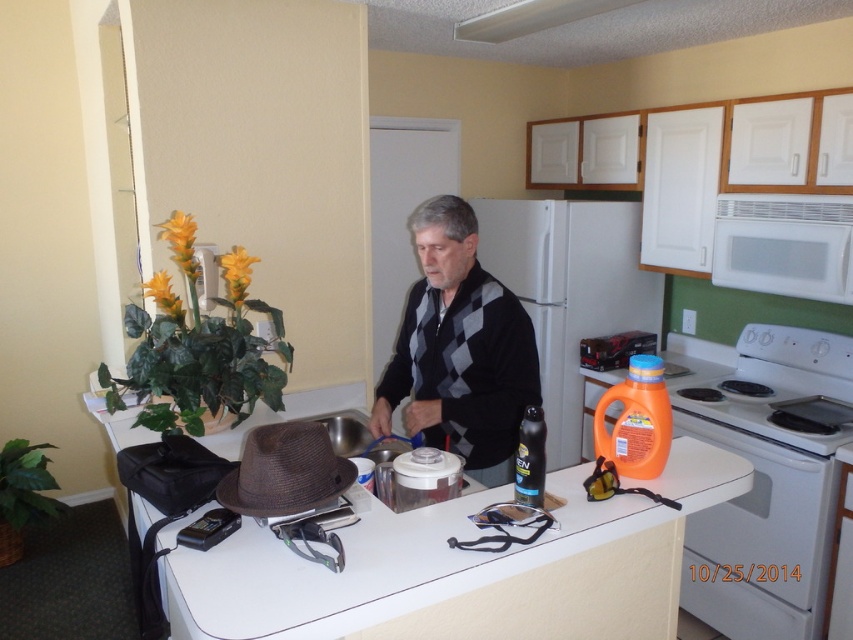
Question: Does orange plastic detergent at right appear on the left side of matte black spray can at center?

Choices:
 (A) no
 (B) yes

Answer: (A)

Question: Is white matte counter at center thinner than orange plastic detergent at right?

Choices:
 (A) yes
 (B) no

Answer: (B)

Question: Is gray argyle sweater at center further to the viewer compared to white glossy stove at right?

Choices:
 (A) no
 (B) yes

Answer: (A)

Question: Which of these objects is positioned farthest from the matte black spray can at center?

Choices:
 (A) gray argyle sweater at center
 (B) orange plastic laundry detergent at right
 (C) white matte counter at center

Answer: (A)

Question: Among these objects, which one is farthest from the camera?

Choices:
 (A) white matte microwave at upper right
 (B) white plastic exhaust hood at upper center

Answer: (A)

Question: Which of the following is the farthest from the observer?

Choices:
 (A) (521, 35)
 (B) (561, 326)
 (C) (335, 468)

Answer: (B)